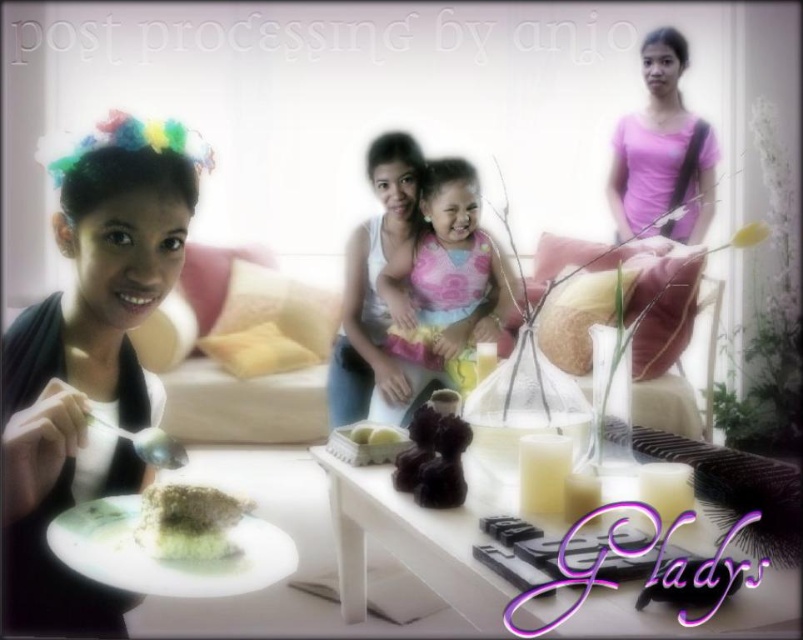
You are a chef who wants to place the matte black cake at lower left on the white glossy table at center. Can you do this without the cake falling over?

The matte black cake at lower left is much taller than the white glossy table at center, so placing it on the table might cause it to be unstable and potentially fall over due to its height.

You are a photographer adjusting lighting for a photoshoot. You need to ensure that the matte black cake at lower left and the pink fabric dress at center are both well lit. Given their sizes, which object might require more focused lighting to ensure visibility?

The matte black cake at lower left has a lesser width compared to the pink fabric dress at center, so it might require more focused lighting to ensure its smaller size is adequately illuminated and visible in the photo.

You are a photographer standing at a certain distance from the white glossy table at center. If your camera lens has a maximum focus range of 30 inches, will it be able to capture the table in focus?

The distance between the white glossy table at center and the camera is 29.61 inches, which is within the camera lens maximum focus range of 30 inches. Therefore, the camera can capture the table in focus.